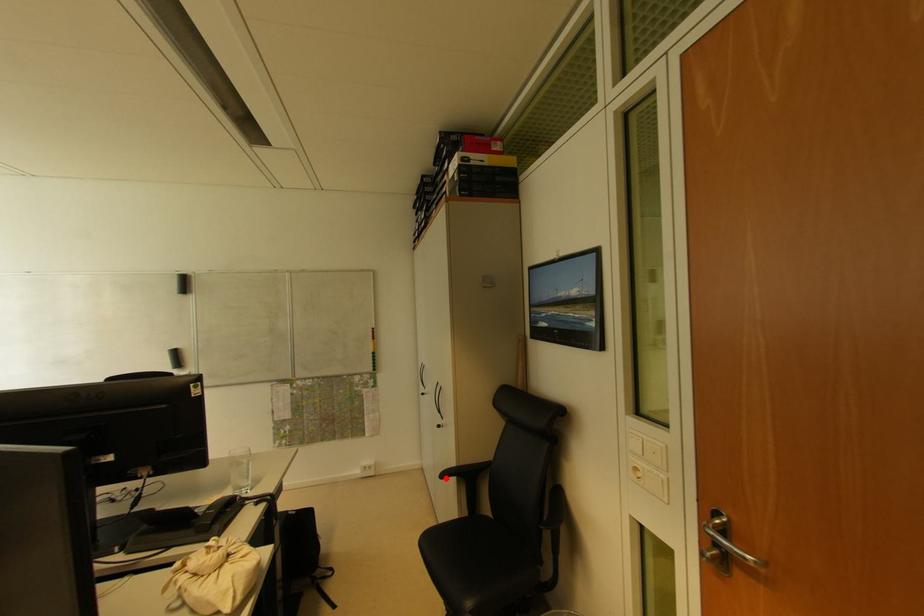
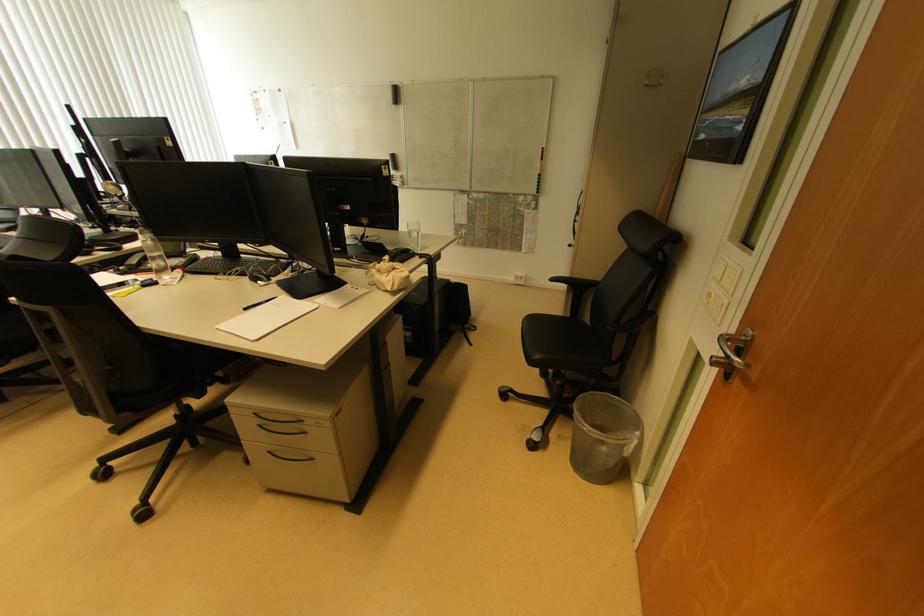
Question: I am providing you with two images of the same scene from different viewpoints. Given a red point in image1, look at the same physical point in image2. Is it:

Choices:
 (A) Closer to the viewpoint
 (B) Farther from the viewpoint

Answer: (A)